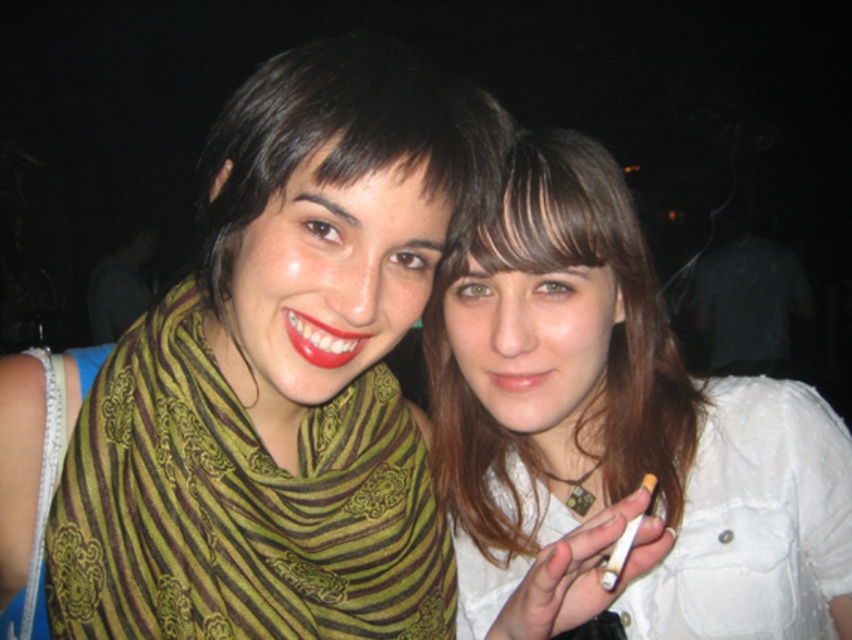
Question: Which is farther from the green striped scarf at left?

Choices:
 (A) matte pink lips at center
 (B) glossy red lipstick at center

Answer: (A)

Question: Which of the following is the farthest from the observer?

Choices:
 (A) (496, 371)
 (B) (539, 320)
 (C) (194, 628)
 (D) (308, 342)

Answer: (A)

Question: Does white textured shirt at center have a smaller size compared to glossy red lipstick at center?

Choices:
 (A) no
 (B) yes

Answer: (A)

Question: Can you confirm if white textured shirt at center is positioned above matte pink lips at center?

Choices:
 (A) no
 (B) yes

Answer: (A)

Question: Among these objects, which one is nearest to the camera?

Choices:
 (A) glossy red lipstick at center
 (B) white textured shirt at center
 (C) green striped scarf at left
 (D) matte pink lips at center

Answer: (A)

Question: Can you confirm if white textured shirt at center is positioned to the left of green striped scarf at left?

Choices:
 (A) yes
 (B) no

Answer: (B)